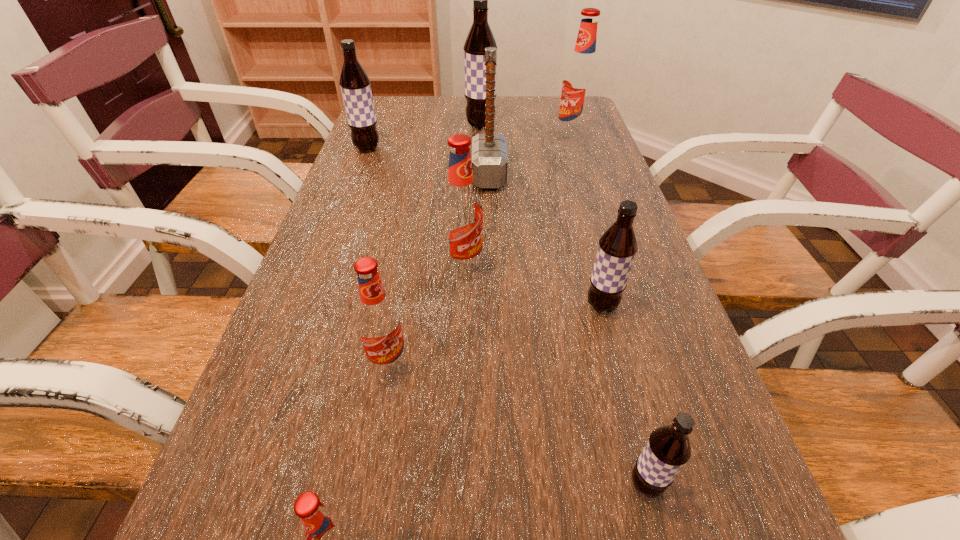
Find the location of a particular element. This screenshot has width=960, height=540. free space at the right edge of the desktop is located at coordinates (581, 219).

In the image, there is a desktop. Where is `vacant space at the far left corner`? This screenshot has height=540, width=960. vacant space at the far left corner is located at coordinates (392, 98).

Where is `vacant region between the third farthest brown root beer and the biggest red root beer`? The width and height of the screenshot is (960, 540). vacant region between the third farthest brown root beer and the biggest red root beer is located at coordinates tap(587, 223).

The width and height of the screenshot is (960, 540). Find the location of `blank region between the rightmost red root beer and the nearest brown root beer`. blank region between the rightmost red root beer and the nearest brown root beer is located at coordinates (609, 312).

Locate an element on the screen. Image resolution: width=960 pixels, height=540 pixels. free area in between the third nearest object and the leftmost root beer is located at coordinates (378, 256).

This screenshot has width=960, height=540. Find the location of `free space between the second farthest brown root beer and the farthest root beer`. free space between the second farthest brown root beer and the farthest root beer is located at coordinates (424, 137).

Where is `vacant area that lies between the second biggest brown root beer and the sixth farthest root beer`? vacant area that lies between the second biggest brown root beer and the sixth farthest root beer is located at coordinates click(x=378, y=256).

Locate an element on the screen. The height and width of the screenshot is (540, 960). empty location between the second red root beer from right to left and the third nearest root beer is located at coordinates (426, 316).

You are a GUI agent. You are given a task and a screenshot of the screen. Output one action in this format:
    pyautogui.click(x=<x>, y=<y>)
    Task: Click on the vacant space that is in between the second brown root beer from left to right and the sixth farthest root beer
    Image resolution: width=960 pixels, height=540 pixels.
    Given the screenshot: What is the action you would take?
    click(x=435, y=245)

Identify which object is the seventh closest to the fifth farthest object. Please provide its 2D coordinates. Your answer should be formatted as a tuple, i.e. [(x, y)], where the tuple contains the x and y coordinates of a point satisfying the conditions above.

[(579, 87)]